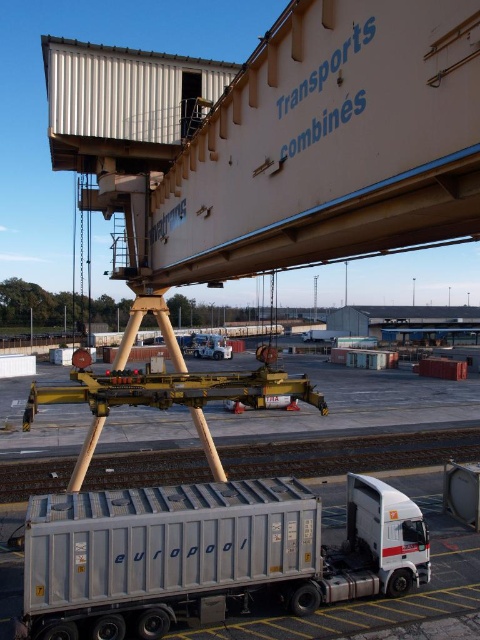
Is point (439, 461) behind point (225, 348)?

No, (439, 461) is closer to viewer.

This screenshot has height=640, width=480. What do you see at coordinates (349, 452) in the screenshot?
I see `metal train track at lower center` at bounding box center [349, 452].

What do you see at coordinates (349, 452) in the screenshot? Image resolution: width=480 pixels, height=640 pixels. I see `metal train track at lower center` at bounding box center [349, 452].

Find the location of a particular element. The width and height of the screenshot is (480, 640). metal train track at lower center is located at coordinates (349, 452).

Is silver metallic trailer truck at lower center further to camera compared to metal train track at lower center?

No, silver metallic trailer truck at lower center is in front of metal train track at lower center.

You are a GUI agent. You are given a task and a screenshot of the screen. Output one action in this format:
    pyautogui.click(x=<x>, y=<y>)
    Task: Click on the silver metallic trailer truck at lower center
    
    Given the screenshot: What is the action you would take?
    pyautogui.click(x=207, y=554)

Who is more forward, (231, 595) or (420, 449)?

Point (231, 595) is in front.

Locate an element on the screen. Image resolution: width=480 pixels, height=640 pixels. silver metallic trailer truck at lower center is located at coordinates (207, 554).

Does silver metallic trailer truck at lower center appear under metallic silver truck at center?

Yes.

Can you confirm if silver metallic trailer truck at lower center is positioned to the right of metallic silver truck at center?

Indeed, silver metallic trailer truck at lower center is positioned on the right side of metallic silver truck at center.

What do you see at coordinates (207, 554) in the screenshot? I see `silver metallic trailer truck at lower center` at bounding box center [207, 554].

You are a GUI agent. You are given a task and a screenshot of the screen. Output one action in this format:
    pyautogui.click(x=<x>, y=<y>)
    Task: Click on the silver metallic trailer truck at lower center
    This screenshot has height=640, width=480.
    Given the screenshot: What is the action you would take?
    pyautogui.click(x=207, y=554)